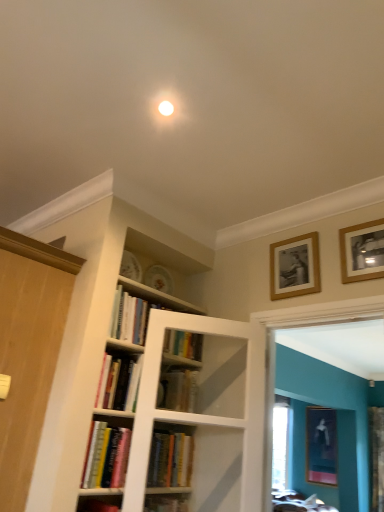
Question: Is wooden picture frame at upper right, which is the second picture frame in bottom-to-top order, far from wooden picture frame at upper right, positioned as the 1th picture frame in front-to-back order?

Choices:
 (A) no
 (B) yes

Answer: (A)

Question: Is wooden picture frame at upper right, placed as the third picture frame when sorted from right to left, not inside wooden picture frame at upper right, positioned as the 1th picture frame in front-to-back order?

Choices:
 (A) yes
 (B) no

Answer: (A)

Question: Considering the relative positions of wooden picture frame at upper right, positioned as the 2th picture frame in front-to-back order, and wooden picture frame at upper right, positioned as the 1th picture frame in front-to-back order, in the image provided, is wooden picture frame at upper right, positioned as the 2th picture frame in front-to-back order, to the right of wooden picture frame at upper right, positioned as the 1th picture frame in front-to-back order, from the viewer's perspective?

Choices:
 (A) no
 (B) yes

Answer: (A)

Question: From a real-world perspective, is wooden picture frame at upper right, positioned as the 2th picture frame in front-to-back order, physically below wooden picture frame at upper right, arranged as the third picture frame when viewed from the back?

Choices:
 (A) no
 (B) yes

Answer: (A)

Question: Does wooden picture frame at upper right, the 2th picture frame in the back-to-front sequence, turn towards wooden picture frame at upper right, positioned as the 1th picture frame in front-to-back order?

Choices:
 (A) no
 (B) yes

Answer: (A)

Question: Can you confirm if wooden picture frame at upper right, the 2th picture frame in the back-to-front sequence, is positioned to the left of wooden picture frame at upper right, the second picture frame viewed from the right?

Choices:
 (A) no
 (B) yes

Answer: (B)

Question: Is matte black picture frame at lower right, positioned as the 1th picture frame in right-to-left order, in front of hardcover books at center, positioned as the 4th book in bottom-to-top order?

Choices:
 (A) no
 (B) yes

Answer: (A)

Question: Does matte black picture frame at lower right, which is the third picture frame in front-to-back order, turn towards hardcover books at center, positioned as the 4th book in bottom-to-top order?

Choices:
 (A) no
 (B) yes

Answer: (A)

Question: Is hardcover books at center, positioned as the 4th book in bottom-to-top order, completely or partially inside matte black picture frame at lower right, the 3th picture frame from the top?

Choices:
 (A) yes
 (B) no

Answer: (B)

Question: Is matte black picture frame at lower right, the 1th picture frame when ordered from back to front, oriented away from hardcover books at center, positioned as the 4th book in bottom-to-top order?

Choices:
 (A) yes
 (B) no

Answer: (B)

Question: Can you confirm if matte black picture frame at lower right, the first picture frame positioned from the bottom, is wider than hardcover books at center, the first book viewed from the top?

Choices:
 (A) no
 (B) yes

Answer: (A)

Question: Can you confirm if matte black picture frame at lower right, which is the third picture frame in front-to-back order, is smaller than hardcover books at center, positioned as the 4th book in bottom-to-top order?

Choices:
 (A) no
 (B) yes

Answer: (A)

Question: Does hardcover books at center, positioned as the 4th book in bottom-to-top order, lie in front of matte black picture frame at lower right, the 1th picture frame when ordered from back to front?

Choices:
 (A) no
 (B) yes

Answer: (B)